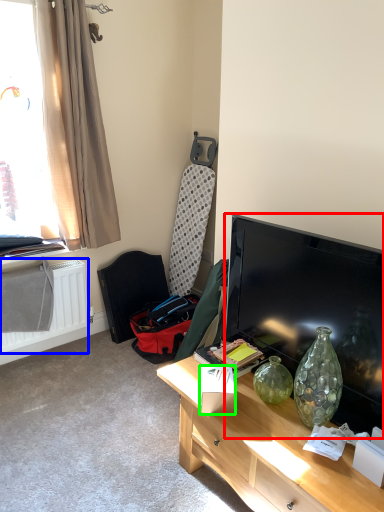
Question: Considering the real-world distances, which object is closest to television (highlighted by a red box)? radiator (highlighted by a blue box) or box (highlighted by a green box).

Choices:
 (A) radiator
 (B) box

Answer: (B)